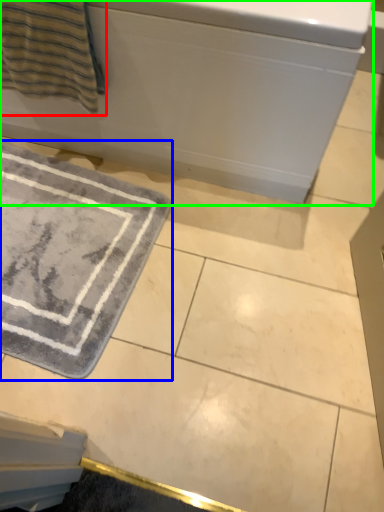
Question: Which object is positioned farthest from beach towel (highlighted by a red box)? Select from bath mat (highlighted by a blue box) and bath (highlighted by a green box).

Choices:
 (A) bath mat
 (B) bath

Answer: (A)